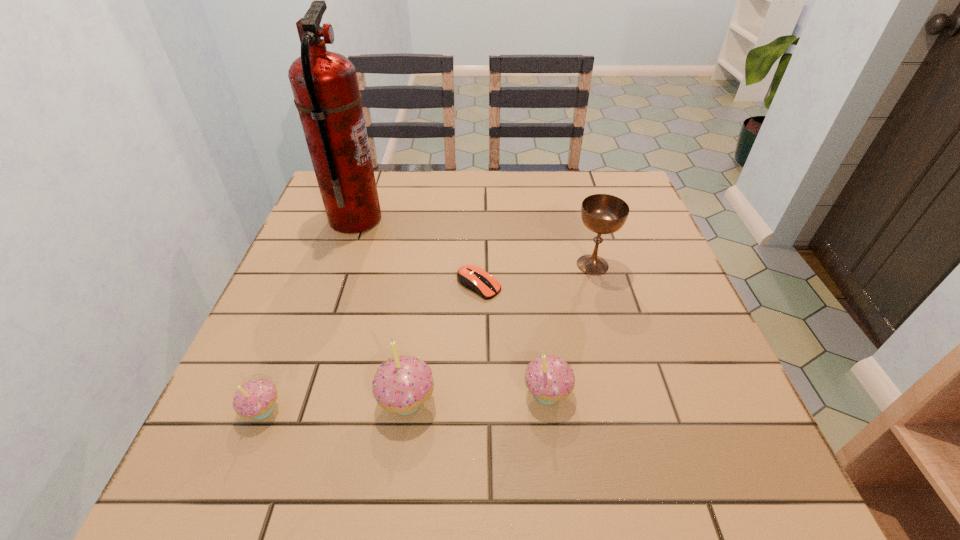
In order to click on the rightmost object in this screenshot , I will do `click(601, 213)`.

The image size is (960, 540). In order to click on vacant space situated on the right of the fifth tallest object in this screenshot , I will do `click(507, 410)`.

Find the location of `vacant space located 0.280m on the right of the second cupcake from left to right`. vacant space located 0.280m on the right of the second cupcake from left to right is located at coordinates (591, 401).

Where is `blank area located 0.360m on the back of the third shortest object`? This screenshot has height=540, width=960. blank area located 0.360m on the back of the third shortest object is located at coordinates (529, 252).

Where is `blank space located on the side of the tallest object with the handle and hose`? The height and width of the screenshot is (540, 960). blank space located on the side of the tallest object with the handle and hose is located at coordinates (411, 220).

Find the location of a particular element. The height and width of the screenshot is (540, 960). vacant space situated on the left of the third object from right to left is located at coordinates (305, 285).

In order to click on vacant area situated 0.210m on the back of the chalice in this screenshot , I will do (x=576, y=204).

The image size is (960, 540). In order to click on object located at the far edge in this screenshot , I will do `click(326, 93)`.

At what (x,y) coordinates should I click in order to perform the action: click on cupcake positioned at the left edge. Please return your answer as a coordinate pair (x, y). Looking at the image, I should click on (255, 399).

You are a GUI agent. You are given a task and a screenshot of the screen. Output one action in this format:
    pyautogui.click(x=<x>, y=<y>)
    Task: Click on the fire extinguisher that is at the left edge
    The height and width of the screenshot is (540, 960).
    Given the screenshot: What is the action you would take?
    pyautogui.click(x=326, y=93)